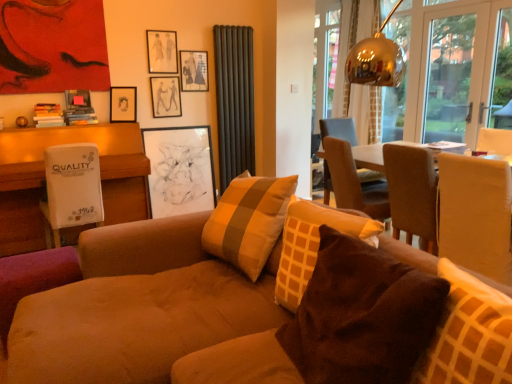
Question: Which is correct: white cardboard box at left is inside matte black picture frame at upper center, the fourth picture frame in the bottom-to-top sequence, or outside of it?

Choices:
 (A) inside
 (B) outside

Answer: (B)

Question: In the image, is white cardboard box at left positioned in front of or behind matte black picture frame at upper center, which appears as the 2th picture frame when viewed from the top?

Choices:
 (A) behind
 (B) front

Answer: (B)

Question: Based on their relative distances, which object is farther from the wooden table at center?

Choices:
 (A) black matte picture frame at center, the 5th picture frame in the top-to-bottom sequence
 (B) matte black picture frame at upper center, the 5th picture frame in the bottom-to-top sequence
 (C) brown velvety pillow at center, which is counted as the 2th pillow, starting from the right
 (D) brown fabric pillow at lower right, acting as the 1th pillow starting from the right
 (E) suede couch at center

Answer: (B)

Question: Which is nearer to the brown velvety pillow at center, which is counted as the 2th pillow, starting from the right?

Choices:
 (A) suede couch at center
 (B) matte black picture frame at upper left, acting as the second picture frame starting from the bottom
 (C) matte black picture frame at upper center, which appears as the 2th picture frame when viewed from the top
 (D) matte black picture frame at upper center, the 1th picture frame in the top-to-bottom sequence
 (E) white cardboard box at left

Answer: (A)